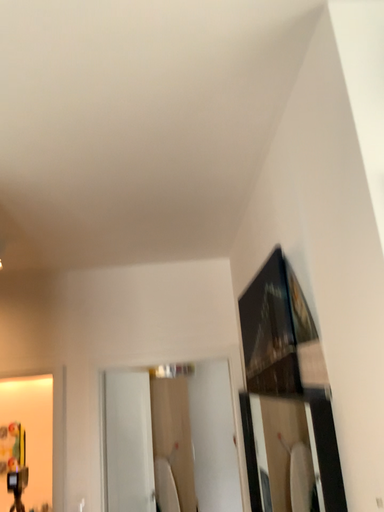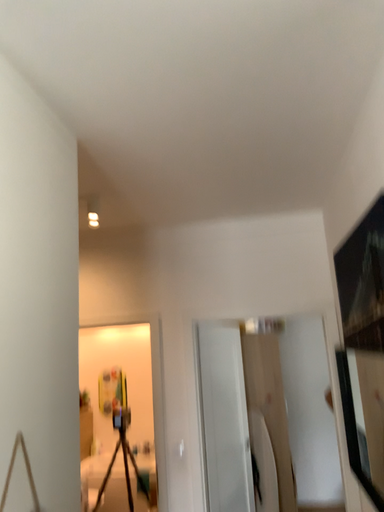
Question: Which way did the camera rotate in the video?

Choices:
 (A) rotated right
 (B) rotated left

Answer: (B)